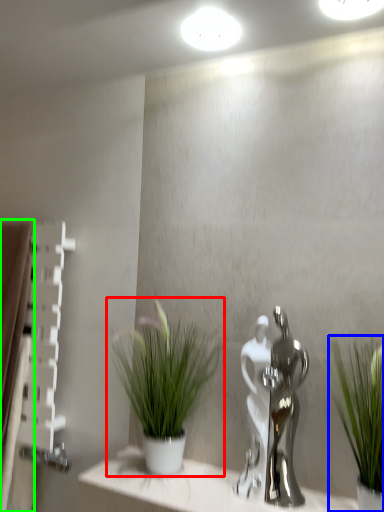
Question: Which object is positioned closest to houseplant (highlighted by a red box)? Select from houseplant (highlighted by a blue box) and curtain (highlighted by a green box).

Choices:
 (A) houseplant
 (B) curtain

Answer: (A)